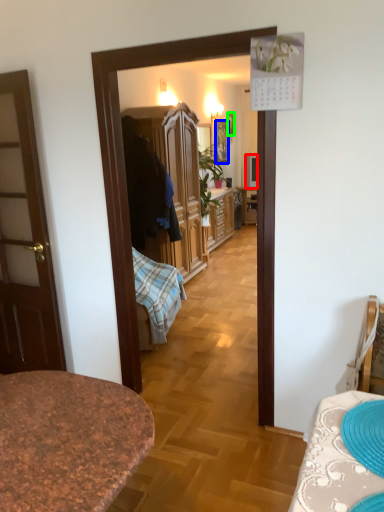
Question: Which is farther away from television (highlighted by a red box)? picture frame (highlighted by a blue box) or picture frame (highlighted by a green box)?

Choices:
 (A) picture frame
 (B) picture frame

Answer: (B)